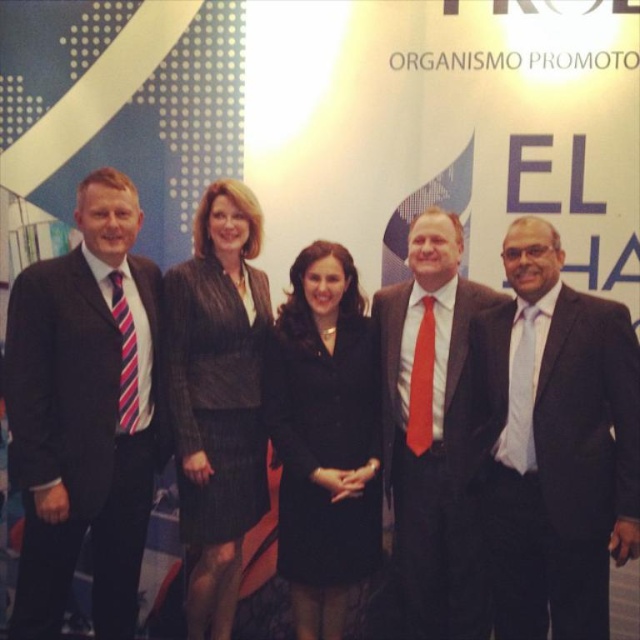
Question: Based on their relative distances, which object is farther from the black wool coat at center?

Choices:
 (A) black textured blazer at center
 (B) black suit at right

Answer: (B)

Question: Which point is closer to the camera?

Choices:
 (A) (497, 572)
 (B) (376, 513)
 (C) (448, 298)
 (D) (36, 492)

Answer: (D)

Question: Does black suit at right have a greater width compared to matte black suit at center?

Choices:
 (A) no
 (B) yes

Answer: (A)

Question: Does black textured blazer at center have a larger size compared to matte black suit at center?

Choices:
 (A) no
 (B) yes

Answer: (B)

Question: Which point is farther to the camera?

Choices:
 (A) (408, 385)
 (B) (202, 458)
 (C) (19, 288)
 (D) (308, 627)

Answer: (D)

Question: Does black suit at right appear under black wool coat at center?

Choices:
 (A) no
 (B) yes

Answer: (A)